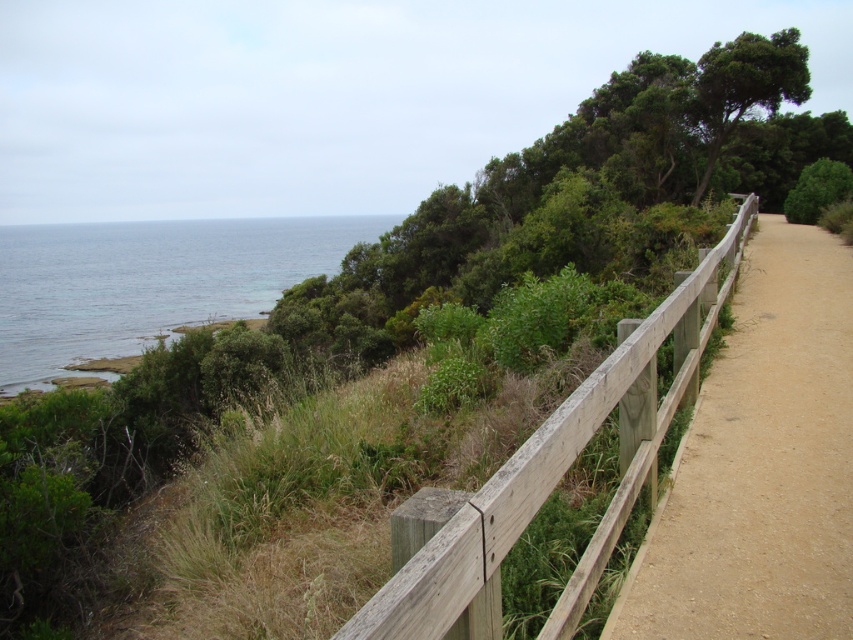
Question: Is clear blue water at left above wooden fence at center-right?

Choices:
 (A) yes
 (B) no

Answer: (A)

Question: Can you confirm if clear blue water at left is positioned to the right of wooden fence at center-right?

Choices:
 (A) yes
 (B) no

Answer: (B)

Question: Which point is farther to the camera?

Choices:
 (A) (67, 371)
 (B) (834, 451)
 (C) (555, 625)

Answer: (A)

Question: Which point appears closest to the camera in this image?

Choices:
 (A) (267, 253)
 (B) (602, 419)

Answer: (B)

Question: Which point is farther from the camera taking this photo?

Choices:
 (A) (675, 557)
 (B) (358, 234)
 (C) (563, 420)

Answer: (B)

Question: From the image, what is the correct spatial relationship of brown dirt path at center-right in relation to clear blue water at left?

Choices:
 (A) above
 (B) below

Answer: (B)